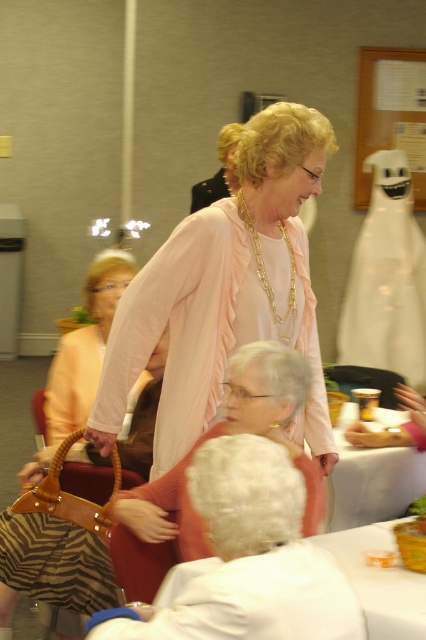
You are standing at the point labeled point (183,337) and want to move to the point labeled point (382,454). Which direction should you face to walk towards your destination?

You should face backward because point (183,337) is in front of point (382,454), so moving towards your destination requires facing away from the direction you are currently facing.